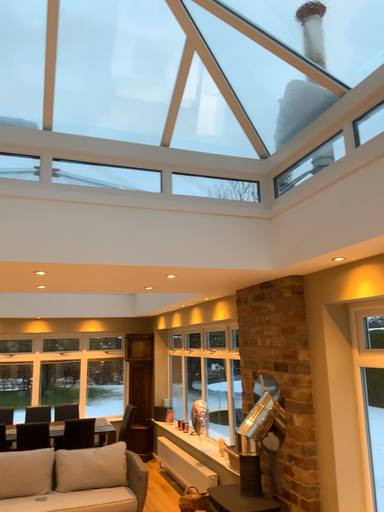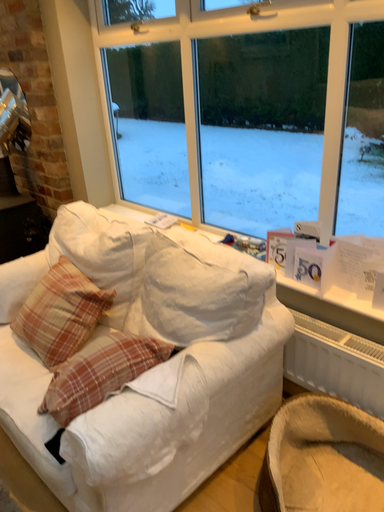
Question: Which way did the camera rotate in the video?

Choices:
 (A) rotated downward
 (B) rotated upward

Answer: (A)